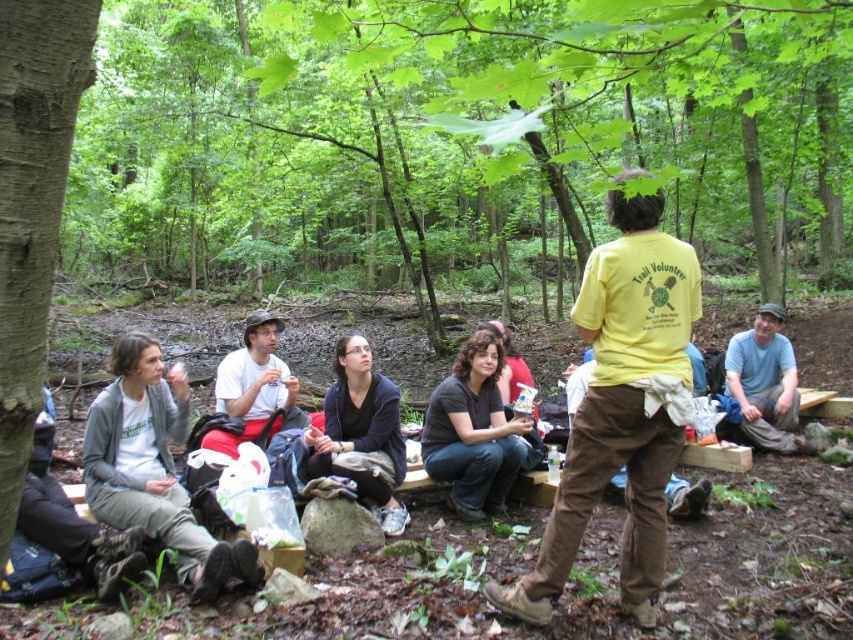
Between yellow cotton shirt at center and gray fleece jacket at lower left, which one is positioned higher?

Positioned higher is yellow cotton shirt at center.

Does yellow cotton shirt at center have a smaller size compared to gray fleece jacket at lower left?

Actually, yellow cotton shirt at center might be larger than gray fleece jacket at lower left.

Is point (605, 253) positioned behind point (254, 545)?

No, it is not.

At what (x,y) coordinates should I click in order to perform the action: click on yellow cotton shirt at center. Please return your answer as a coordinate pair (x, y). Looking at the image, I should click on (622, 408).

Who is higher up, smooth brown bark at left or blue cotton shirt at lower right?

smooth brown bark at left is higher up.

Which is behind, point (64, 141) or point (762, 324)?

Point (762, 324)

Is point (3, 118) farther from viewer compared to point (740, 387)?

That is False.

I want to click on smooth brown bark at left, so click(32, 205).

Is black cotton shirt at center further to the viewer compared to black matte jacket at center?

Yes.

What are the coordinates of `black cotton shirt at center` in the screenshot? It's located at (473, 429).